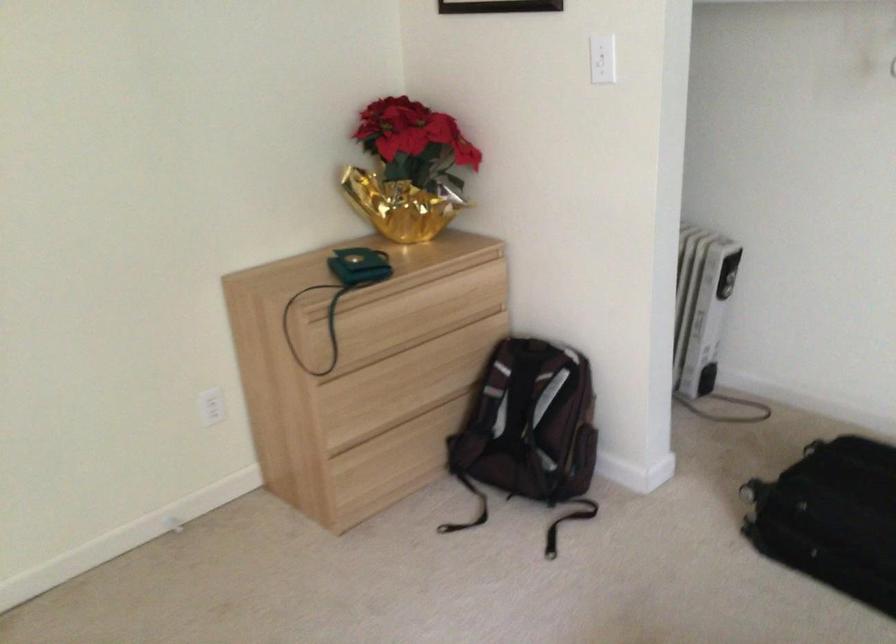
What do you see at coordinates (362, 335) in the screenshot? This screenshot has height=644, width=896. I see `the top drawer pull` at bounding box center [362, 335].